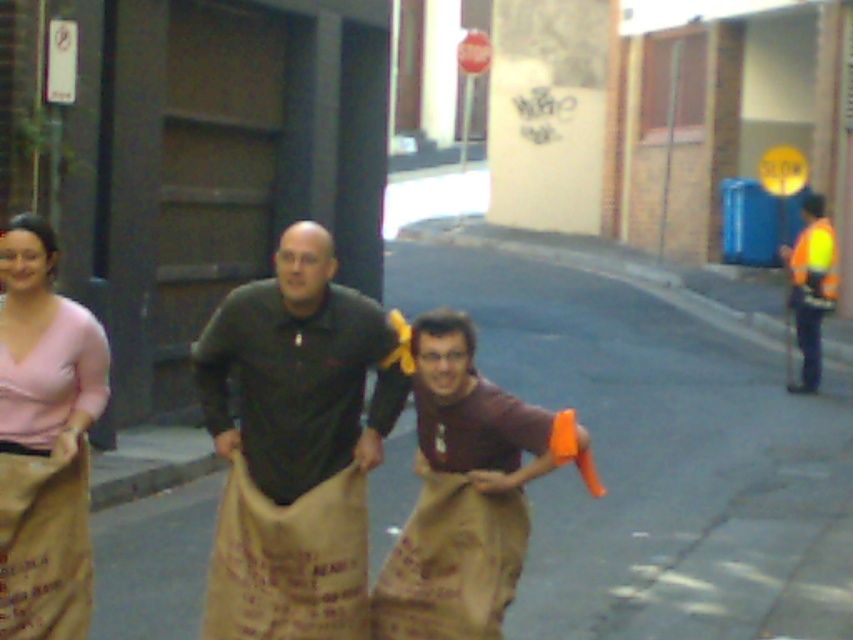
Which of these two, matte pink sweater at left or high-visibility reflective vest at right, stands taller?

high-visibility reflective vest at right

Image resolution: width=853 pixels, height=640 pixels. I want to click on matte pink sweater at left, so click(x=44, y=440).

I want to click on matte pink sweater at left, so click(44, 440).

The image size is (853, 640). Describe the element at coordinates (297, 442) in the screenshot. I see `burlap sack at center` at that location.

Can you confirm if burlap sack at center is positioned below brown paper sack at center?

Actually, burlap sack at center is above brown paper sack at center.

Does point (234, 364) lie behind point (450, 508)?

Yes, it is behind point (450, 508).

Find the location of `burlap sack at center`. burlap sack at center is located at coordinates (297, 442).

Does matte black shirt at center appear on the right side of high-visibility reflective vest at right?

No, matte black shirt at center is not to the right of high-visibility reflective vest at right.

Is matte black shirt at center below high-visibility reflective vest at right?

Yes, matte black shirt at center is below high-visibility reflective vest at right.

Locate an element on the screen. matte black shirt at center is located at coordinates (297, 371).

The image size is (853, 640). What are the coordinates of `matte black shirt at center` in the screenshot? It's located at (297, 371).